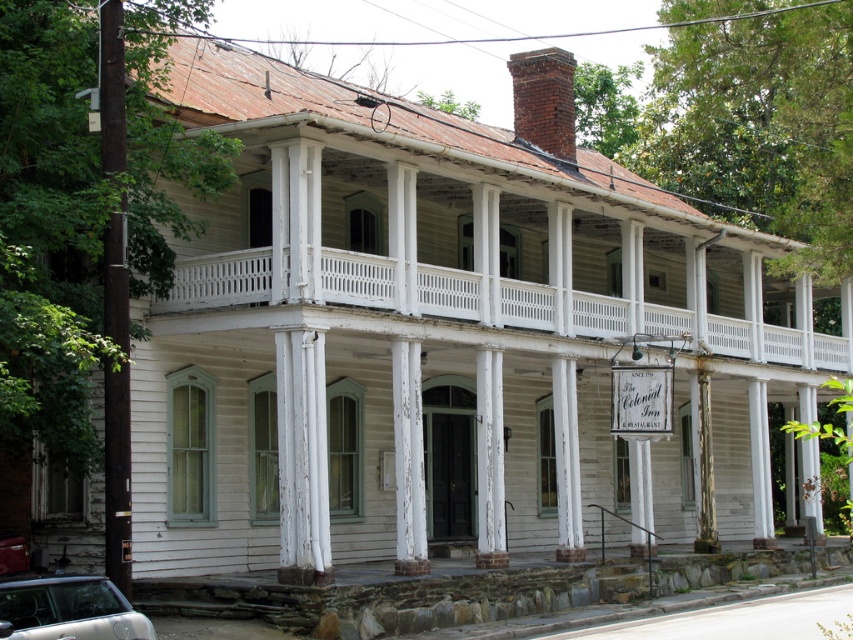
Question: Estimate the real-world distances between objects in this image. Which object is farther from the white weathered wood at center?

Choices:
 (A) silver metallic car at lower left
 (B) white wooden porch at upper center
 (C) brick chimney at upper center
 (D) white peeling paint at center

Answer: (A)

Question: Which of the following is the farthest from the observer?

Choices:
 (A) brick chimney at upper center
 (B) silver metallic car at lower left
 (C) white weathered wood column at center
 (D) white wooden porch at upper center

Answer: (A)

Question: Is white peeling paint at center positioned at the back of brick chimney at upper center?

Choices:
 (A) no
 (B) yes

Answer: (A)

Question: Which of the following is the closest to the observer?

Choices:
 (A) brick chimney at upper center
 (B) silver metallic car at lower left
 (C) white peeling paint at center

Answer: (B)

Question: Does white peeling paint at center have a smaller size compared to white weathered wood at center?

Choices:
 (A) yes
 (B) no

Answer: (B)

Question: Does silver metallic car at lower left have a greater width compared to white weathered wood at center?

Choices:
 (A) yes
 (B) no

Answer: (A)